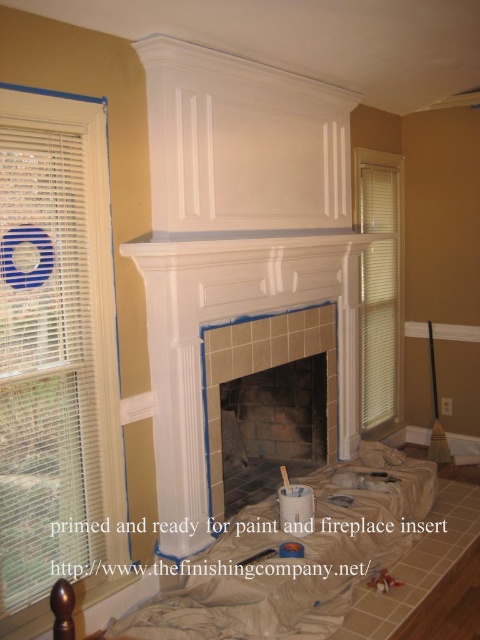
You are standing in the room and want to touch both the white blinds at left and the white tile fireplace at center. Which object will you reach first?

You will reach the white blinds at left first because it is closer to you than the white tile fireplace at center.